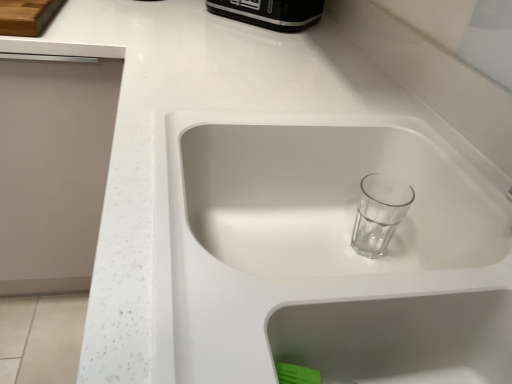
Question: Should I look upward or downward to see black plastic toaster at upper center?

Choices:
 (A) up
 (B) down

Answer: (A)